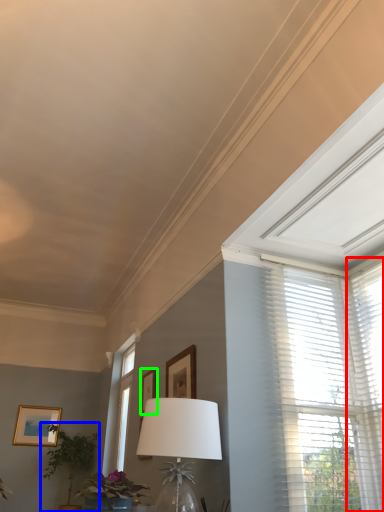
Question: Which is nearer to the window blind (highlighted by a red box)? houseplant (highlighted by a blue box) or picture frame (highlighted by a green box).

Choices:
 (A) houseplant
 (B) picture frame

Answer: (B)